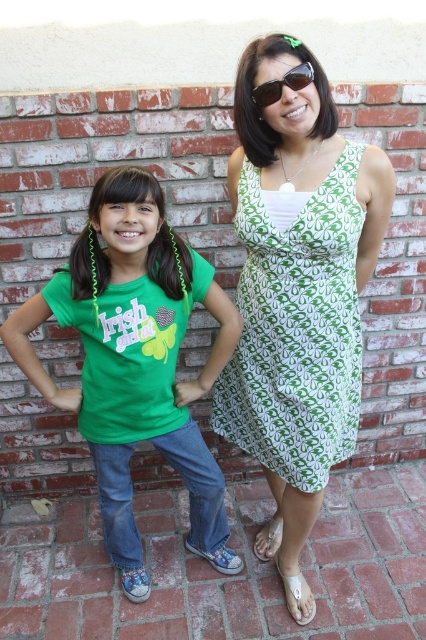
From the picture: Can you confirm if green matte t-shirt at left is wider than green printed dress at center?

Correct, the width of green matte t-shirt at left exceeds that of green printed dress at center.

Who is shorter, green matte t-shirt at left or green printed dress at center?

green printed dress at center

Which is behind, point (40, 374) or point (267, 330)?

Point (40, 374)

I want to click on green matte t-shirt at left, so click(x=135, y=362).

Who is lower down, green matte t-shirt at left or sunglasses at upper center?

green matte t-shirt at left

Which is above, green matte t-shirt at left or sunglasses at upper center?

sunglasses at upper center

Find the location of a particular element. This screenshot has height=640, width=426. green matte t-shirt at left is located at coordinates (135, 362).

Measure the distance between point (x=319, y=212) and camera.

4.58 feet

Is green printed dress at center thinner than sunglasses at upper center?

No, green printed dress at center is not thinner than sunglasses at upper center.

Where is `green printed dress at center`? green printed dress at center is located at coordinates (296, 330).